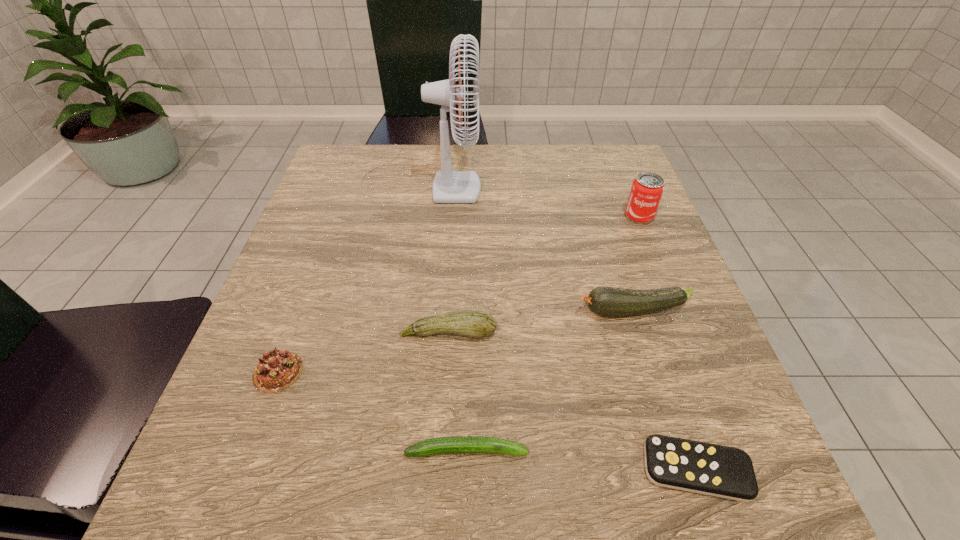
I want to click on fan, so click(x=449, y=186).

Locate an element on the screen. the sixth shortest object is located at coordinates (647, 189).

Locate an element on the screen. the rightmost zucchini is located at coordinates (606, 301).

This screenshot has height=540, width=960. I want to click on the second shortest zucchini, so click(473, 323).

Identify the location of the third shortest object. (277, 370).

This screenshot has width=960, height=540. I want to click on chocolate cake, so click(277, 370).

Locate an element on the screen. Image resolution: width=960 pixels, height=540 pixels. the shortest zucchini is located at coordinates pos(458,444).

Find the location of a particular element. The width and height of the screenshot is (960, 540). remote control is located at coordinates (716, 470).

You are a GUI agent. You are given a task and a screenshot of the screen. Output one action in this format:
    pyautogui.click(x=<x>, y=<y>)
    Task: Click on the free space located on the front-facing side of the tallest object
    Image resolution: width=960 pixels, height=540 pixels.
    Given the screenshot: What is the action you would take?
    pyautogui.click(x=617, y=177)

What are the coordinates of `free spot located on the back of the can` in the screenshot? It's located at (617, 161).